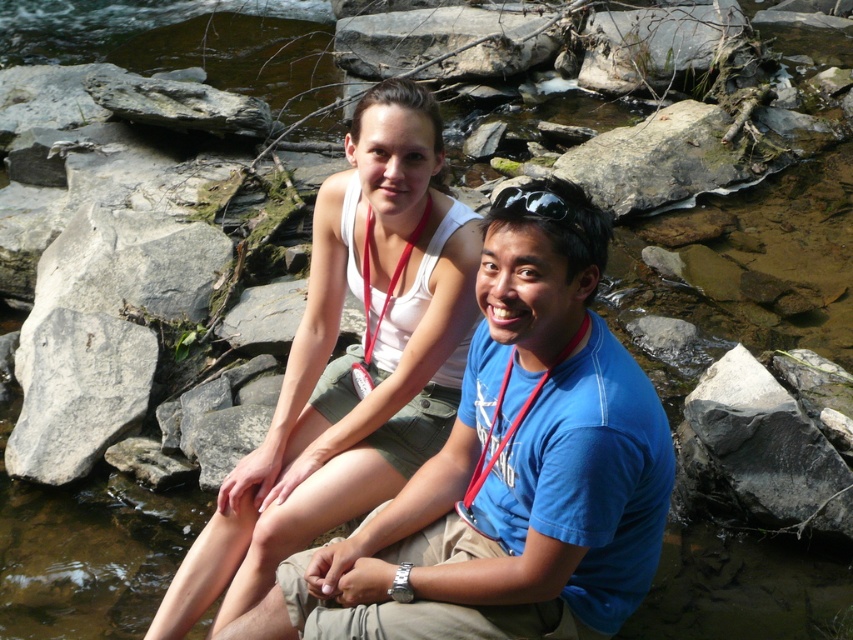
Question: Which point appears closest to the camera in this image?

Choices:
 (A) (22, 372)
 (B) (440, 433)
 (C) (614, 392)
 (D) (721, 376)

Answer: (C)

Question: Does white fabric tank top at center appear on the right side of black smooth rock at lower right?

Choices:
 (A) yes
 (B) no

Answer: (B)

Question: Is blue cotton shirt at center thinner than white smooth rock at left?

Choices:
 (A) yes
 (B) no

Answer: (B)

Question: Does blue cotton shirt at center appear over black smooth rock at lower right?

Choices:
 (A) no
 (B) yes

Answer: (B)

Question: Which object is the closest to the blue cotton shirt at center?

Choices:
 (A) black rubber goggles at upper center
 (B) white smooth rock at left
 (C) black smooth rock at lower right

Answer: (A)

Question: Which of these objects is positioned closest to the white smooth rock at left?

Choices:
 (A) black smooth rock at lower right
 (B) blue cotton shirt at center

Answer: (B)